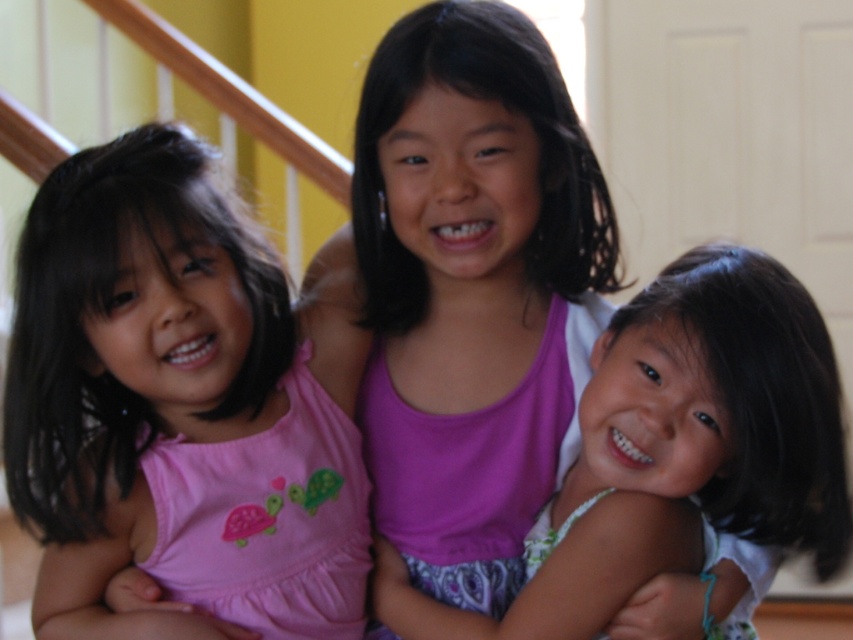
Question: Among these points, which one is farthest from the camera?

Choices:
 (A) (747, 476)
 (B) (38, 588)

Answer: (B)

Question: Does pink fabric dress at center come behind matte pink dress at center?

Choices:
 (A) no
 (B) yes

Answer: (B)

Question: Which point is farther from the camera taking this photo?

Choices:
 (A) (628, 348)
 (B) (213, 260)

Answer: (A)

Question: In this image, where is pink fabric dress at center located relative to matte pink dress at center?

Choices:
 (A) below
 (B) above

Answer: (B)

Question: Is pink fabric dress at center to the right of matte pink dress at center from the viewer's perspective?

Choices:
 (A) no
 (B) yes

Answer: (A)